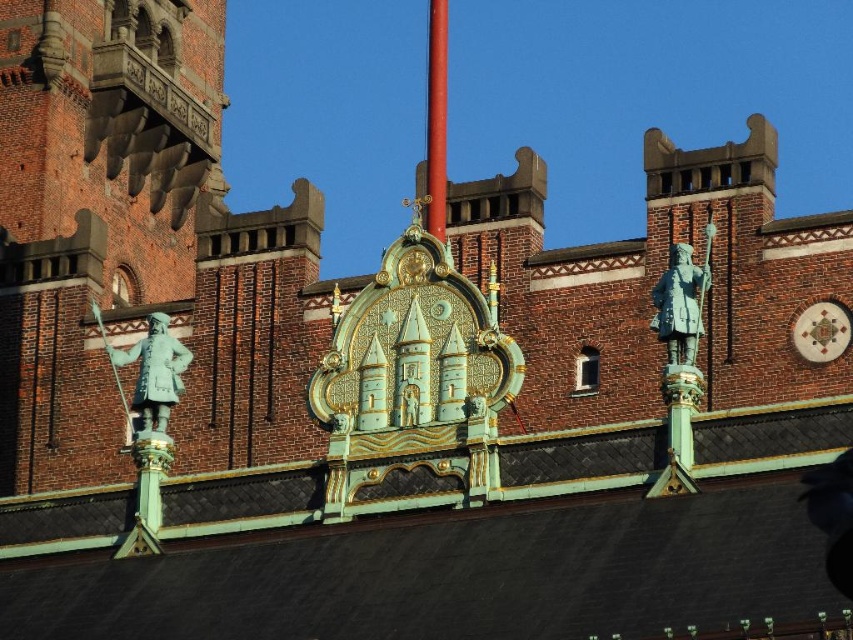
Question: Which of the following is the closest to the observer?

Choices:
 (A) (190, 355)
 (B) (706, 244)
 (C) (444, 22)

Answer: (A)

Question: In this image, where is green patina statue at upper right located relative to red polished metal pole at center?

Choices:
 (A) left
 (B) right

Answer: (B)

Question: Can you confirm if green patina statue at upper right is positioned above red polished metal pole at center?

Choices:
 (A) yes
 (B) no

Answer: (B)

Question: Considering the relative positions of green patina statue at left and red polished metal pole at center in the image provided, where is green patina statue at left located with respect to red polished metal pole at center?

Choices:
 (A) above
 (B) below

Answer: (B)

Question: Which point is farther to the camera?

Choices:
 (A) green patina statue at upper right
 (B) red polished metal pole at center

Answer: (B)

Question: Which point is farther from the camera taking this photo?

Choices:
 (A) (712, 230)
 (B) (440, 115)
 (C) (154, 356)

Answer: (B)